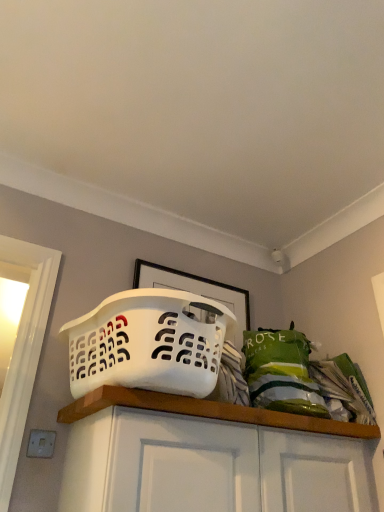
The width and height of the screenshot is (384, 512). Identify the location of white matte cabinet at center. (196, 454).

What do you see at coordinates (196, 454) in the screenshot? This screenshot has width=384, height=512. I see `white matte cabinet at center` at bounding box center [196, 454].

What do you see at coordinates (149, 343) in the screenshot?
I see `white plastic laundry basket at center` at bounding box center [149, 343].

This screenshot has height=512, width=384. I want to click on white plastic laundry basket at center, so click(149, 343).

The image size is (384, 512). In order to click on white matte cabinet at center in this screenshot , I will do coord(196,454).

Is white plastic laundry basket at center at the left side of white matte cabinet at center?

Correct, you'll find white plastic laundry basket at center to the left of white matte cabinet at center.

Is the position of white plastic laundry basket at center less distant than that of white matte cabinet at center?

No, white plastic laundry basket at center is further to the viewer.

Is point (152, 307) positioned after point (173, 399)?

No, it is in front of (173, 399).

From the image's perspective, is white plastic laundry basket at center above white matte cabinet at center?

Correct, white plastic laundry basket at center appears higher than white matte cabinet at center in the image.

From a real-world perspective, is white plastic laundry basket at center under white matte cabinet at center?

No, from a real-world perspective, white plastic laundry basket at center is not beneath white matte cabinet at center.

Is white plastic laundry basket at center thinner than white matte cabinet at center?

No, white plastic laundry basket at center is not thinner than white matte cabinet at center.

From their relative heights in the image, would you say white plastic laundry basket at center is taller or shorter than white matte cabinet at center?

white plastic laundry basket at center is shorter than white matte cabinet at center.

Can you confirm if white plastic laundry basket at center is smaller than white matte cabinet at center?

Actually, white plastic laundry basket at center might be larger than white matte cabinet at center.

Would you say white plastic laundry basket at center contains white matte cabinet at center?

Definitely not — white matte cabinet at center is not inside white plastic laundry basket at center.

Are white plastic laundry basket at center and white matte cabinet at center beside each other?

No, white plastic laundry basket at center is not with white matte cabinet at center.

Is white plastic laundry basket at center facing towards white matte cabinet at center?

No, white plastic laundry basket at center is not oriented towards white matte cabinet at center.

How far apart are white plastic laundry basket at center and white matte cabinet at center?

white plastic laundry basket at center is 22.95 centimeters from white matte cabinet at center.

Image resolution: width=384 pixels, height=512 pixels. I want to click on basket that appears above the white matte cabinet at center (from a real-world perspective), so click(x=149, y=343).

In the scene shown: Is white matte cabinet at center to the left of white plastic laundry basket at center from the viewer's perspective?

No.

Is the position of white matte cabinet at center less distant than that of white plastic laundry basket at center?

Yes.

Which is nearer, [347,432] or [77,348]?

The point [77,348] is closer.

From the image's perspective, is white matte cabinet at center on top of white plastic laundry basket at center?

A: No, from the image's perspective, white matte cabinet at center is not over white plastic laundry basket at center.

From a real-world perspective, relative to white plastic laundry basket at center, is white matte cabinet at center vertically above or below?

From a real-world perspective, white matte cabinet at center is physically below white plastic laundry basket at center.

Considering the sizes of objects white matte cabinet at center and white plastic laundry basket at center in the image provided, who is thinner, white matte cabinet at center or white plastic laundry basket at center?

Thinner between the two is white matte cabinet at center.

From their relative heights in the image, would you say white matte cabinet at center is taller or shorter than white plastic laundry basket at center?

white matte cabinet at center is taller than white plastic laundry basket at center.

From the picture: Can you confirm if white matte cabinet at center is smaller than white plastic laundry basket at center?

Indeed, white matte cabinet at center has a smaller size compared to white plastic laundry basket at center.

Is white matte cabinet at center completely or partially outside of white plastic laundry basket at center?

Indeed, white matte cabinet at center is completely outside white plastic laundry basket at center.

Is white matte cabinet at center next to white plastic laundry basket at center?

No, white matte cabinet at center is not in contact with white plastic laundry basket at center.

Is white matte cabinet at center positioned with its back to white plastic laundry basket at center?

No, white plastic laundry basket at center is not at the back of white matte cabinet at center.

How far apart are white matte cabinet at center and white plastic laundry basket at center?

The distance of white matte cabinet at center from white plastic laundry basket at center is 22.95 centimeters.

Where is `cabinetry in front of the white plastic laundry basket at center`? cabinetry in front of the white plastic laundry basket at center is located at coordinates (196, 454).

Where is `cabinetry on the right of white plastic laundry basket at center`? This screenshot has width=384, height=512. cabinetry on the right of white plastic laundry basket at center is located at coordinates (196, 454).

Find the location of a particular element. The height and width of the screenshot is (512, 384). basket located on the left of white matte cabinet at center is located at coordinates (149, 343).